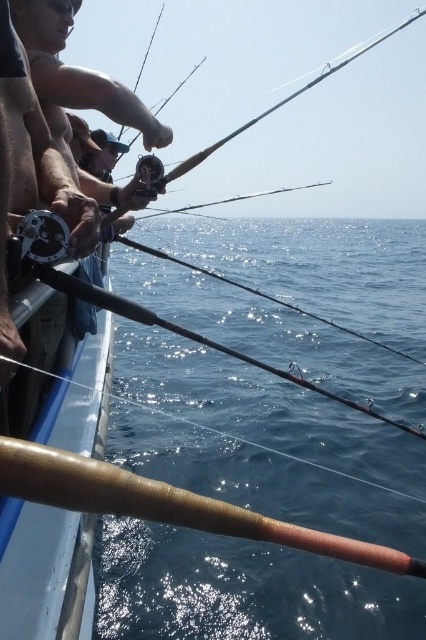
You are on a boat and see the brown wood fishing rod at left and the blue water at center. Which object is closer to you?

The brown wood fishing rod at left is closer to you because it is located below the blue water at center, indicating it is positioned in front of the water from your viewpoint.

You are a photographer trying to capture a closeup of the brown wood fishing rod at left without the wooden textured fishing pole at lower left blocking the view. Is this possible given their positions?

The brown wood fishing rod at left is further to the viewer than the wooden textured fishing pole at lower left, so the photographer can position themselves behind the brown wood fishing rod at left to avoid the wooden textured fishing pole at lower left blocking the view.